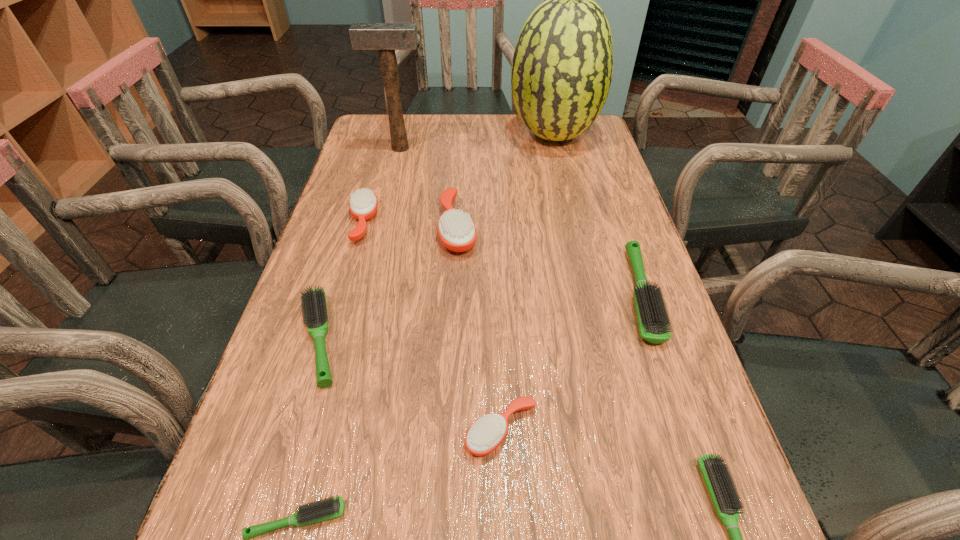
Image resolution: width=960 pixels, height=540 pixels. Find the location of `vacant space located 0.130m on the front of the biggest orange hairbrush`. vacant space located 0.130m on the front of the biggest orange hairbrush is located at coordinates (454, 303).

What are the coordinates of `vacant space located on the front of the second smallest orange hairbrush` in the screenshot? It's located at (332, 326).

Find the location of a particular element. The image size is (960, 540). free spot located 0.370m on the back of the biggest light hairbrush is located at coordinates (595, 164).

At what (x,y) coordinates should I click in order to perform the action: click on vacant area situated 0.260m on the right of the second biggest light hairbrush. Please return your answer as a coordinate pair (x, y). Image resolution: width=960 pixels, height=540 pixels. Looking at the image, I should click on (483, 339).

At what (x,y) coordinates should I click in order to perform the action: click on free spot located 0.100m on the left of the smallest orange hairbrush. Please return your answer as a coordinate pair (x, y). Image resolution: width=960 pixels, height=540 pixels. Looking at the image, I should click on (403, 430).

Identify the location of watermelon present at the far edge. (562, 66).

You are a GUI agent. You are given a task and a screenshot of the screen. Output one action in this format:
    pyautogui.click(x=<x>, y=<y>)
    Task: Click on the mallet that is at the far edge
    
    Given the screenshot: What is the action you would take?
    pyautogui.click(x=386, y=37)

The width and height of the screenshot is (960, 540). What are the coordinates of `mallet located at the left edge` in the screenshot? It's located at (386, 37).

I want to click on watermelon that is at the right edge, so click(x=562, y=66).

You are a GUI agent. You are given a task and a screenshot of the screen. Output one action in this format:
    pyautogui.click(x=<x>, y=<y>)
    Task: Click on the hairbrush that is positioned at the right edge
    The height and width of the screenshot is (540, 960).
    Given the screenshot: What is the action you would take?
    pyautogui.click(x=652, y=318)